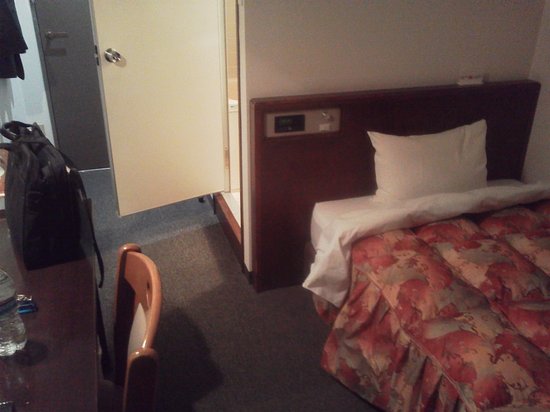
I want to click on mattress, so click(x=334, y=209).